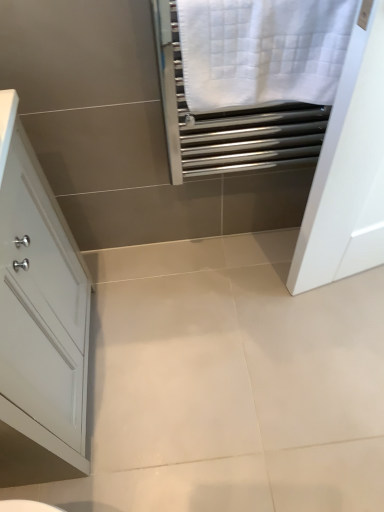
Question: Does point 49,465 appear closer or farther from the camera than point 190,100?

Choices:
 (A) closer
 (B) farther

Answer: (B)

Question: Choose the correct answer: Is white glossy cabinet at left inside white textured towel at upper right or outside it?

Choices:
 (A) outside
 (B) inside

Answer: (A)

Question: From a real-world perspective, relative to white textured towel at upper right, is white glossy cabinet at left vertically above or below?

Choices:
 (A) above
 (B) below

Answer: (B)

Question: From a real-world perspective, relative to white glossy cabinet at left, is white textured towel at upper right vertically above or below?

Choices:
 (A) above
 (B) below

Answer: (A)

Question: In terms of size, does white textured towel at upper right appear bigger or smaller than white glossy cabinet at left?

Choices:
 (A) small
 (B) big

Answer: (A)

Question: From the image's perspective, relative to white glossy cabinet at left, is white textured towel at upper right above or below?

Choices:
 (A) above
 (B) below

Answer: (A)

Question: Is white textured towel at upper right taller or shorter than white glossy cabinet at left?

Choices:
 (A) short
 (B) tall

Answer: (A)